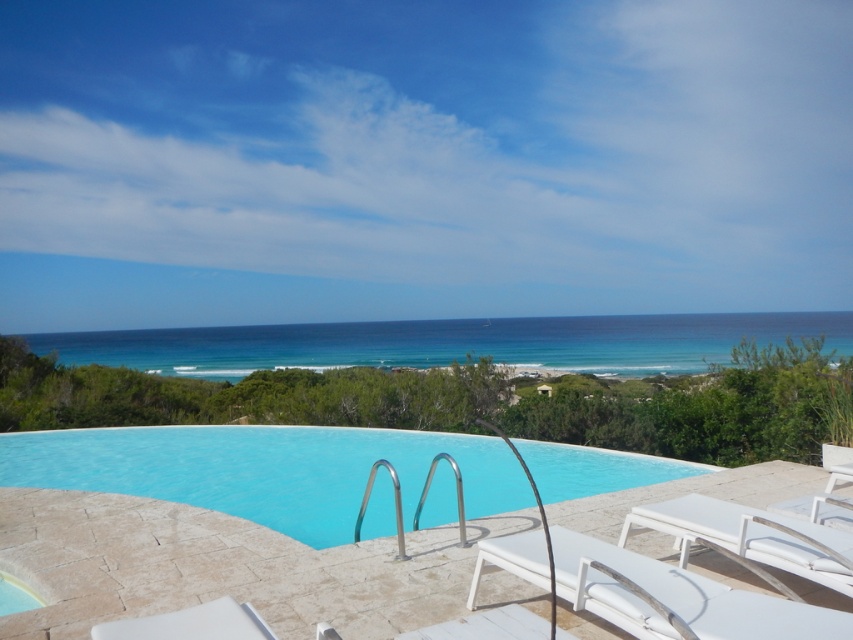
Does smooth glass pool at center have a greater height compared to white matte beach chair at lower right?

No.

Does smooth glass pool at center have a smaller size compared to white matte beach chair at lower right?

Yes.

Does point (115, 436) lie behind point (733, 552)?

Yes, point (115, 436) is behind point (733, 552).

This screenshot has height=640, width=853. I want to click on smooth glass pool at center, so click(x=263, y=468).

Which of these two, white fabric beach chair at lower right or white matte beach chair at lower right, stands taller?

With more height is white fabric beach chair at lower right.

Between point (747, 604) and point (708, 515), which one is positioned in front?

Point (747, 604)

Between point (677, 572) and point (820, 541), which one is positioned behind?

Point (820, 541)

At what (x,y) coordinates should I click in order to perform the action: click on white fabric beach chair at lower right. Please return your answer as a coordinate pair (x, y). The width and height of the screenshot is (853, 640). Looking at the image, I should click on (677, 596).

Is smooth glass pool at center smaller than white fabric beach chair at lower right?

Yes, smooth glass pool at center is smaller than white fabric beach chair at lower right.

Is smooth glass pool at center to the left of white fabric beach chair at lower right from the viewer's perspective?

No, smooth glass pool at center is not to the left of white fabric beach chair at lower right.

You are a GUI agent. You are given a task and a screenshot of the screen. Output one action in this format:
    pyautogui.click(x=<x>, y=<y>)
    Task: Click on the smooth glass pool at center
    The width and height of the screenshot is (853, 640).
    Given the screenshot: What is the action you would take?
    pyautogui.click(x=263, y=468)